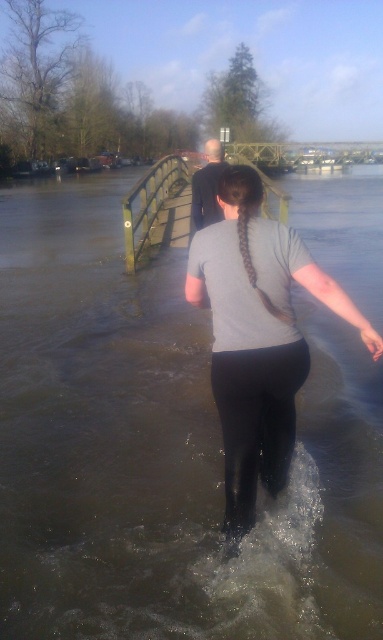
Which is more to the left, brown muddy water at center or wooden bridge at upper center?

brown muddy water at center

Image resolution: width=383 pixels, height=640 pixels. Identify the location of brown muddy water at center. coord(163,449).

Does point (18, 250) come closer to viewer compared to point (283, 141)?

That is True.

Locate an element on the screen. brown muddy water at center is located at coordinates (163, 449).

Who is shorter, brown muddy water at center or smooth bald head at center?

brown muddy water at center

Find the location of a particular element. brown muddy water at center is located at coordinates (163, 449).

From the picture: Can you confirm if wooden bridge at upper center is positioned below smooth bald head at center?

No, wooden bridge at upper center is not below smooth bald head at center.

Looking at this image, does wooden bridge at upper center have a lesser width compared to smooth bald head at center?

Incorrect, wooden bridge at upper center's width is not less than smooth bald head at center's.

Is point (243, 145) closer to viewer compared to point (219, 150)?

No, it is behind (219, 150).

Identify the location of wooden bridge at upper center. (304, 152).